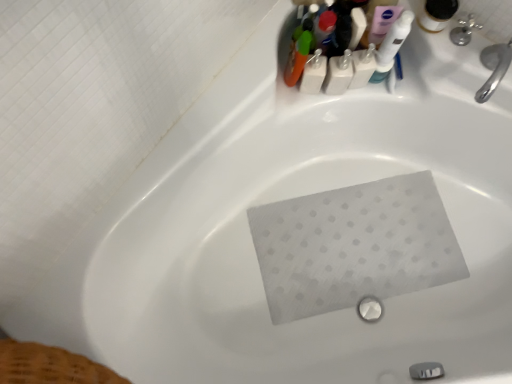
The height and width of the screenshot is (384, 512). What do you see at coordinates (464, 30) in the screenshot?
I see `brushed metal faucet at upper right` at bounding box center [464, 30].

Consider the image. What is the approximate height of brushed metal faucet at upper right?

brushed metal faucet at upper right is 3.12 inches tall.

Locate an element on the screen. Image resolution: width=512 pixels, height=384 pixels. brushed metal faucet at upper right is located at coordinates (464, 30).

The image size is (512, 384). Find the location of `brushed metal faucet at upper right`. brushed metal faucet at upper right is located at coordinates (464, 30).